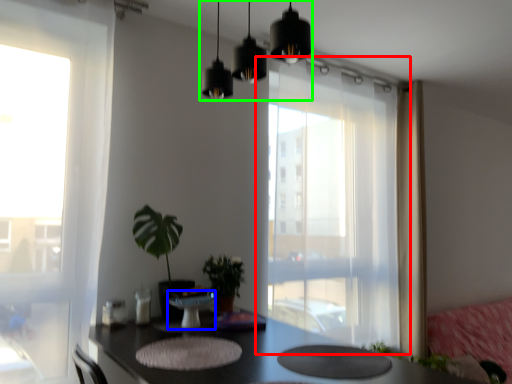
Question: Which object is positioned closest to window (highlighted by a red box)? Select from round table (highlighted by a blue box) and lighting (highlighted by a green box).

Choices:
 (A) round table
 (B) lighting

Answer: (A)